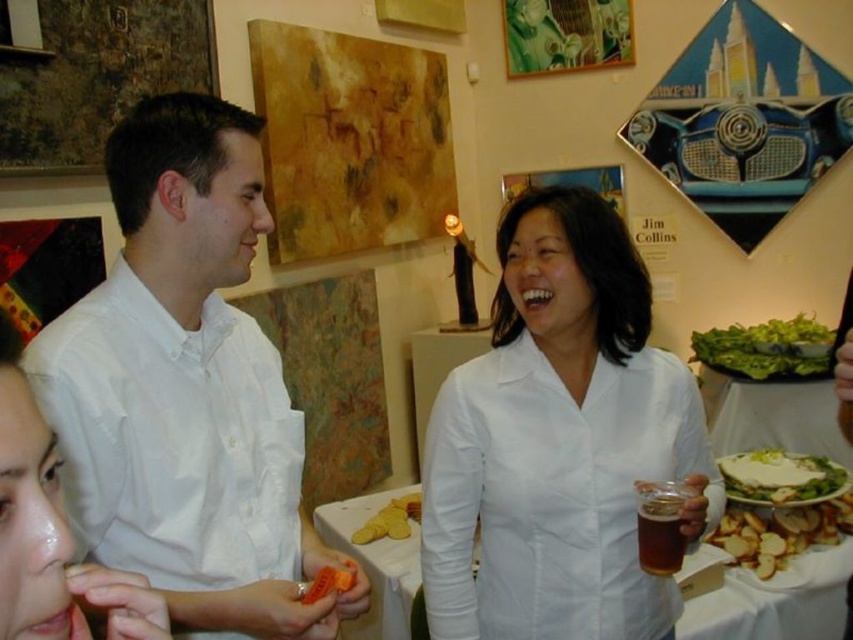
Does white glossy plate at center have a smaller size compared to yellow matte bread at center?

No.

Who is higher up, white glossy plate at center or yellow matte bread at center?

white glossy plate at center

Is point (717, 406) positioned in front of point (399, 525)?

That is False.

Locate an element on the screen. white glossy plate at center is located at coordinates (772, 413).

Does white matte shirt at upper left appear over white fabric table at center?

Indeed, white matte shirt at upper left is positioned over white fabric table at center.

Is point (41, 506) positioned before point (810, 602)?

Yes, point (41, 506) is in front of point (810, 602).

You are a GUI agent. You are given a task and a screenshot of the screen. Output one action in this format:
    pyautogui.click(x=<x>, y=<y>)
    Task: Click on the white matte shirt at upper left
    This screenshot has width=853, height=640.
    Given the screenshot: What is the action you would take?
    pyautogui.click(x=51, y=532)

Who is more forward, (751, 467) or (399, 520)?

Point (399, 520)

Who is higher up, white creamy cheese at center or yellow matte bread at center?

white creamy cheese at center

This screenshot has width=853, height=640. What do you see at coordinates (780, 477) in the screenshot?
I see `white creamy cheese at center` at bounding box center [780, 477].

Identify the location of white creamy cheese at center. (780, 477).